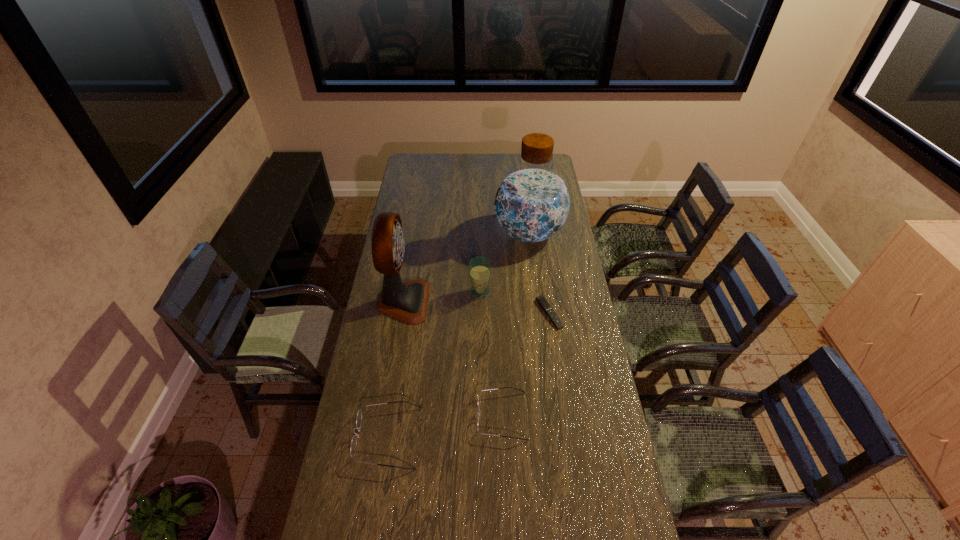
Image resolution: width=960 pixels, height=540 pixels. Find the location of `the left spectacles`. the left spectacles is located at coordinates (353, 446).

Where is `the taller spectacles`? Image resolution: width=960 pixels, height=540 pixels. the taller spectacles is located at coordinates (353, 446).

Find the location of a particular element. the shorter spectacles is located at coordinates (505, 387).

At what (x,y) coordinates should I click in order to perform the action: click on the right spectacles. Please return your answer as a coordinate pair (x, y). This screenshot has width=960, height=540. Looking at the image, I should click on (505, 387).

You are a GUI agent. You are given a task and a screenshot of the screen. Output one action in this format:
    pyautogui.click(x=<x>, y=<y>)
    Task: Click on the glass
    This screenshot has height=540, width=960.
    Given the screenshot: What is the action you would take?
    pyautogui.click(x=480, y=267)

I want to click on fan, so click(x=407, y=302).

At what (x,y) coordinates should I click in order to perform the action: click on water jug. Please return your answer as a coordinate pair (x, y). The width and height of the screenshot is (960, 540). Looking at the image, I should click on (532, 203).

At what (x,y) coordinates should I click in order to perform the action: click on the shortest object. Please return your answer as a coordinate pair (x, y). This screenshot has width=960, height=540. Looking at the image, I should click on (543, 303).

Identify the location of vacant area located through the lenses of the right spectacles. (389, 416).

You are a GUI agent. You are given a task and a screenshot of the screen. Output one action in this format:
    pyautogui.click(x=<x>, y=<y>)
    Task: Click on the free space located through the lenses of the right spectacles
    The height and width of the screenshot is (540, 960).
    Given the screenshot: What is the action you would take?
    pos(427,416)